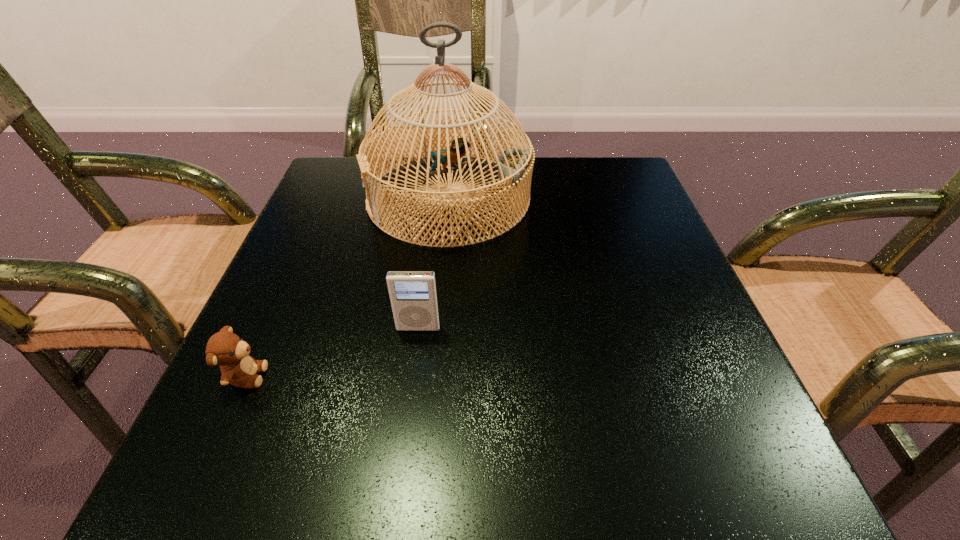
Image resolution: width=960 pixels, height=540 pixels. Find the location of `empty space that is in between the farthest object and the second nearest object`. empty space that is in between the farthest object and the second nearest object is located at coordinates (434, 263).

Find the location of a particular element. blank region between the farthest object and the second tallest object is located at coordinates (434, 263).

Where is `free space that is in between the second tallest object and the teddy bear`? free space that is in between the second tallest object and the teddy bear is located at coordinates (332, 352).

This screenshot has width=960, height=540. What are the coordinates of `vacant area between the leftmost object and the farthest object` in the screenshot? It's located at pos(348,287).

I want to click on free space between the iPod and the farthest object, so click(x=434, y=263).

The height and width of the screenshot is (540, 960). In order to click on empty location between the leftmost object and the second farthest object in this screenshot , I will do `click(332, 352)`.

Where is `free space between the farthest object and the shortest object`? Image resolution: width=960 pixels, height=540 pixels. free space between the farthest object and the shortest object is located at coordinates (348, 287).

Locate an element on the screen. The height and width of the screenshot is (540, 960). vacant space that is in between the second shortest object and the farthest object is located at coordinates (434, 263).

The image size is (960, 540). Find the location of `free point between the farthest object and the teddy bear`. free point between the farthest object and the teddy bear is located at coordinates (348, 287).

Identify the location of object that stands as the second closest to the shortest object. (515, 165).